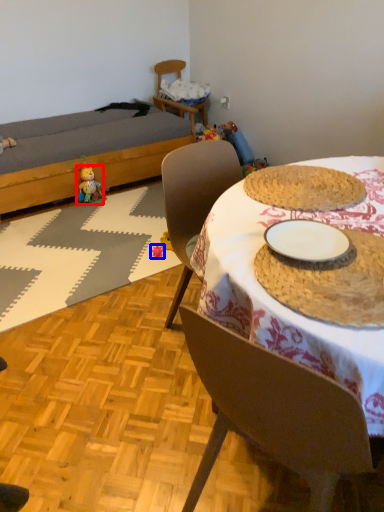
Question: Which object is closer to the camera taking this photo, toy (highlighted by a red box) or toy (highlighted by a blue box)?

Choices:
 (A) toy
 (B) toy

Answer: (B)